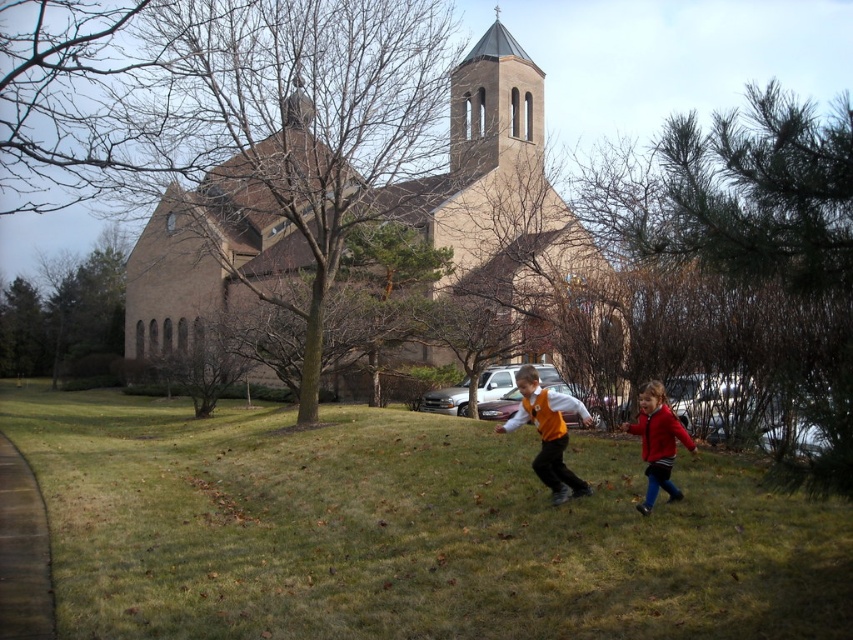
Question: Estimate the real-world distances between objects in this image. Which object is closer to the orange matte vest at center?

Choices:
 (A) red fleece jacket at lower right
 (B) beige stone church at center

Answer: (A)

Question: Which point is closer to the camera taking this photo?

Choices:
 (A) [662, 461]
 (B) [491, 195]

Answer: (A)

Question: Does beige stone church at center have a larger size compared to red fleece jacket at lower right?

Choices:
 (A) yes
 (B) no

Answer: (A)

Question: Does green grass at center lie in front of orange matte vest at center?

Choices:
 (A) no
 (B) yes

Answer: (B)

Question: Estimate the real-world distances between objects in this image. Which object is closer to the beige stone church at center?

Choices:
 (A) red fleece jacket at lower right
 (B) green grass at center
 (C) orange matte vest at center

Answer: (B)

Question: Is orange matte vest at center bigger than red fleece jacket at lower right?

Choices:
 (A) yes
 (B) no

Answer: (B)